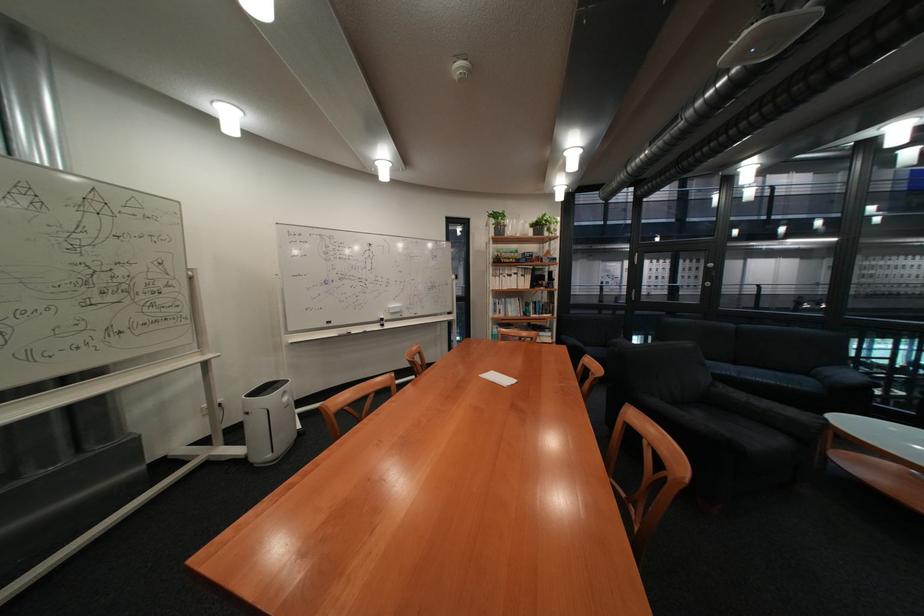
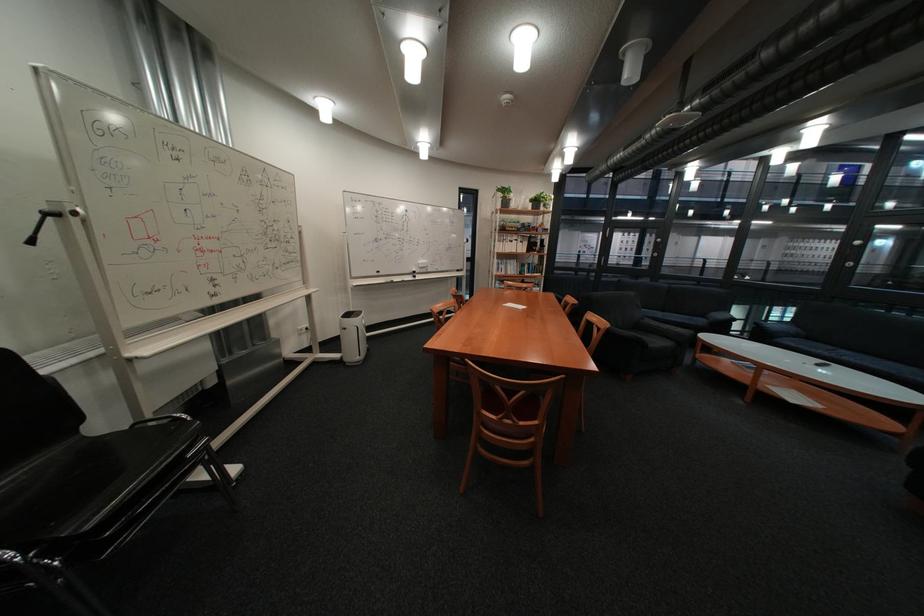
Locate, in the second image, the point that corresponds to the point at 640,422 in the first image.

(602, 320)